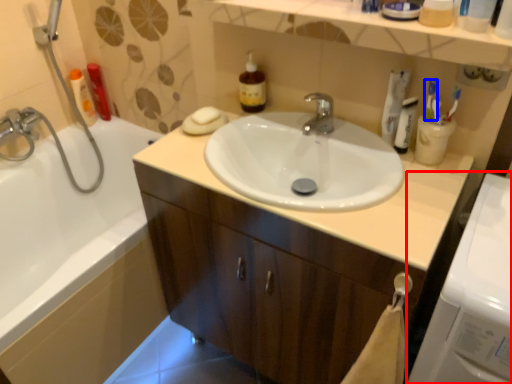
Question: Among these objects, which one is nearest to the camera, washing machine (highlighted by a red box) or toothbrush (highlighted by a blue box)?

Choices:
 (A) washing machine
 (B) toothbrush

Answer: (A)